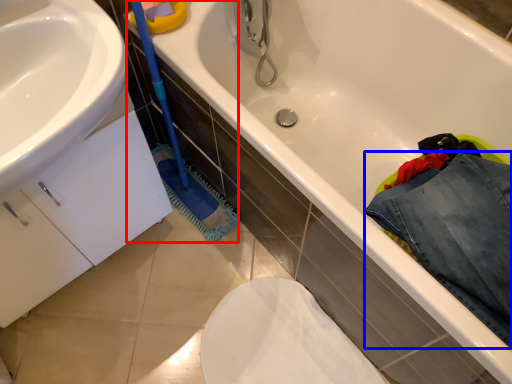
Question: Which object is closer to the camera taking this photo, brush (highlighted by a red box) or clothing (highlighted by a blue box)?

Choices:
 (A) brush
 (B) clothing

Answer: (A)